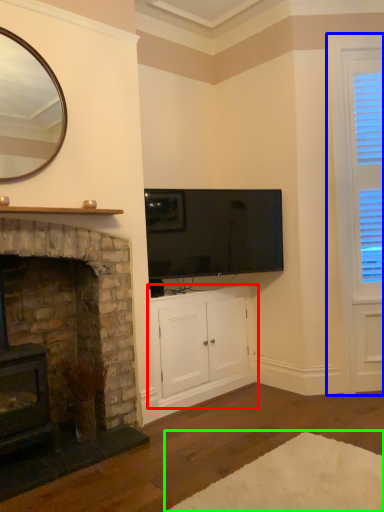
Question: Estimate the real-world distances between objects in this image. Which object is farther from cabinetry (highlighted by a red box), window frame (highlighted by a blue box) or plain (highlighted by a green box)?

Choices:
 (A) window frame
 (B) plain

Answer: (A)